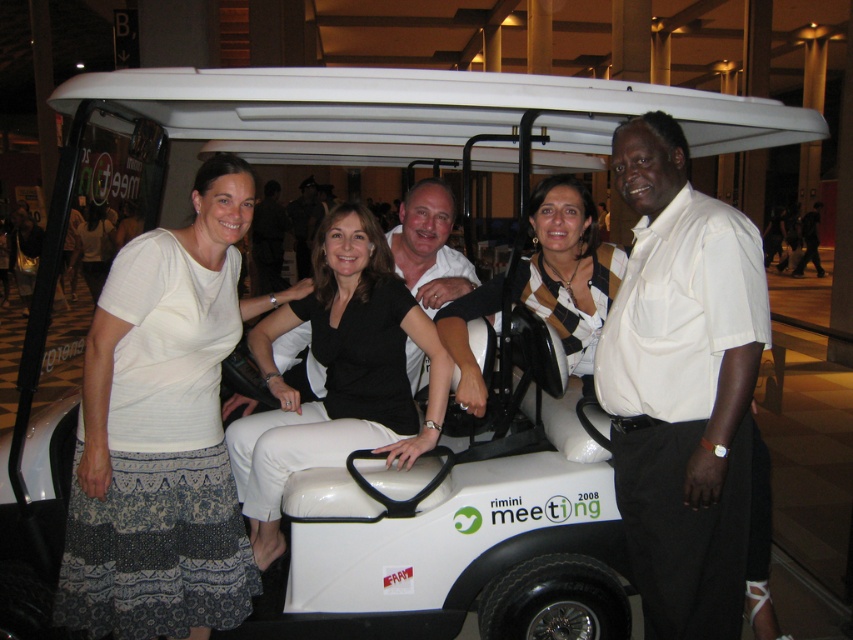
In the scene shown: Who is shorter, white textured skirt at lower left or matte black shirt at center?

With less height is white textured skirt at lower left.

Which is more to the right, white textured skirt at lower left or matte black shirt at center?

white textured skirt at lower left

Does point (125, 253) come behind point (306, 220)?

That is False.

At what (x,y) coordinates should I click in order to perform the action: click on white textured skirt at lower left. Please return your answer as a coordinate pair (x, y). Looking at the image, I should click on (163, 432).

Is point (438, 380) closer to camera compared to point (461, 333)?

Yes, it is.

Does point (387, 420) lie behind point (584, 273)?

No, it is not.

The image size is (853, 640). Find the location of `black matte pants at center`. black matte pants at center is located at coordinates (337, 376).

Which is more to the left, white shirt at center or white smooth golf cart at center?

white smooth golf cart at center is more to the left.

The height and width of the screenshot is (640, 853). In order to click on white shirt at center in this screenshot , I will do `click(682, 385)`.

Between point (625, 499) and point (416, 243), which one is positioned behind?

The point (416, 243) is behind.

The height and width of the screenshot is (640, 853). Identify the location of white shirt at center. (682, 385).